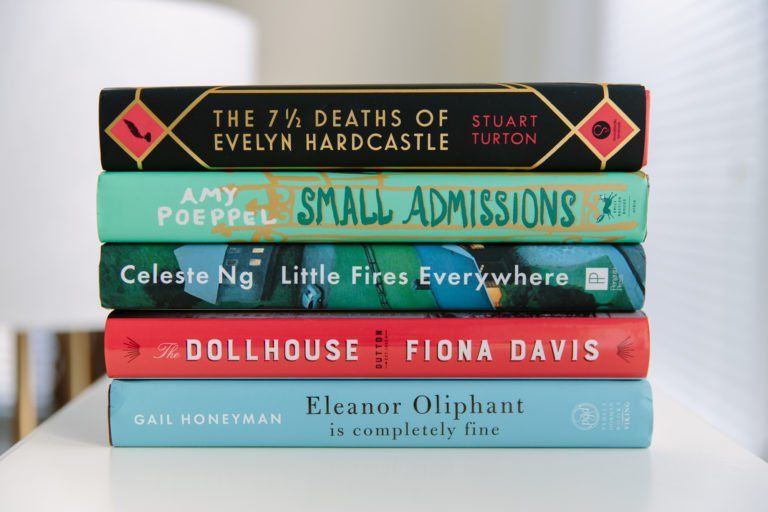
Where is `books`? This screenshot has height=512, width=768. books is located at coordinates (316, 139), (313, 216), (313, 283), (341, 357), (336, 406).